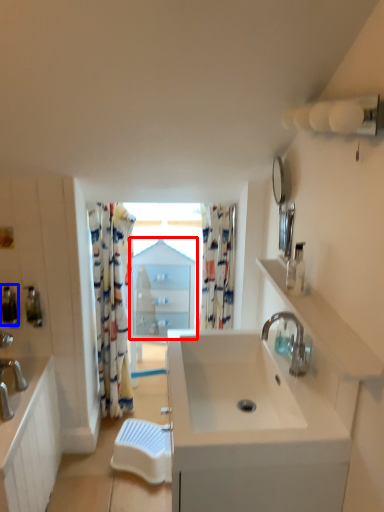
Question: Which of the following is the farthest to the observer, medicine cabinet (highlighted by a red box) or soap dispenser (highlighted by a blue box)?

Choices:
 (A) medicine cabinet
 (B) soap dispenser

Answer: (A)